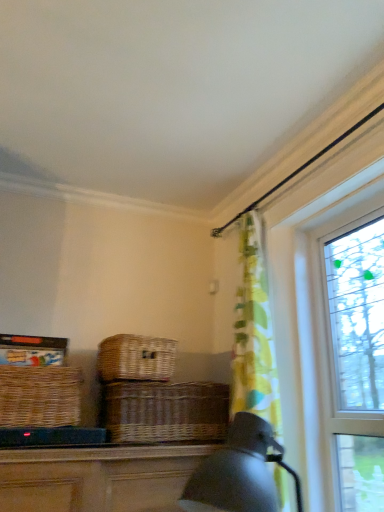
Question: Is brown wicker basket at center outside of woven brown picnic basket at center, acting as the second picnic basket starting from the left?

Choices:
 (A) yes
 (B) no

Answer: (A)

Question: Considering the relative sizes of brown wicker basket at center and woven brown picnic basket at center, the 1th picnic basket from the right, in the image provided, is brown wicker basket at center wider than woven brown picnic basket at center, the 1th picnic basket from the right,?

Choices:
 (A) yes
 (B) no

Answer: (B)

Question: Is brown wicker basket at center at the left side of woven brown picnic basket at center, acting as the second picnic basket starting from the left?

Choices:
 (A) no
 (B) yes

Answer: (A)

Question: Is brown wicker basket at center with woven brown picnic basket at center, acting as the second picnic basket starting from the left?

Choices:
 (A) yes
 (B) no

Answer: (B)

Question: From a real-world perspective, is brown wicker basket at center under woven brown picnic basket at center, acting as the second picnic basket starting from the left?

Choices:
 (A) no
 (B) yes

Answer: (B)

Question: From a real-world perspective, does brown wicker basket at center stand above woven brown picnic basket at center, the 1th picnic basket from the right?

Choices:
 (A) yes
 (B) no

Answer: (B)

Question: Considering the relative sizes of woven brown picnic basket at center, the 1th picnic basket from the right, and clear glass window at right in the image provided, is woven brown picnic basket at center, the 1th picnic basket from the right, wider than clear glass window at right?

Choices:
 (A) yes
 (B) no

Answer: (A)

Question: Is woven brown picnic basket at center, acting as the second picnic basket starting from the left, far away from clear glass window at right?

Choices:
 (A) no
 (B) yes

Answer: (A)

Question: Is woven brown picnic basket at center, acting as the second picnic basket starting from the left, to the right of clear glass window at right from the viewer's perspective?

Choices:
 (A) yes
 (B) no

Answer: (B)

Question: Is woven brown picnic basket at center, the 1th picnic basket from the right, taller than clear glass window at right?

Choices:
 (A) yes
 (B) no

Answer: (B)

Question: Is woven brown picnic basket at center, the 1th picnic basket from the right, positioned with its back to clear glass window at right?

Choices:
 (A) no
 (B) yes

Answer: (A)

Question: Is woven brown picnic basket at center, the 1th picnic basket from the right, shorter than clear glass window at right?

Choices:
 (A) yes
 (B) no

Answer: (A)

Question: Is clear glass window at right at the back of woven brown picnic basket at left, the 1th picnic basket when ordered from left to right?

Choices:
 (A) yes
 (B) no

Answer: (B)